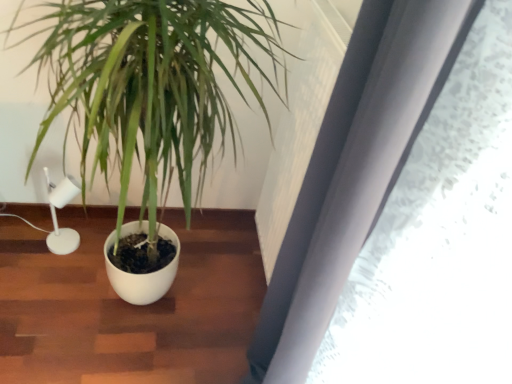
Describe the element at coordinates (152, 87) in the screenshot. I see `green matte plant at center` at that location.

What is the approximate width of green matte plant at center?

green matte plant at center is 78.47 centimeters in width.

Where is `green matte plant at center`? The image size is (512, 384). green matte plant at center is located at coordinates (152, 87).

The height and width of the screenshot is (384, 512). What do you see at coordinates (56, 215) in the screenshot? I see `white matte lamp at left` at bounding box center [56, 215].

In order to click on white matte lamp at left in this screenshot , I will do `click(56, 215)`.

Where is `green matte plant at center`? green matte plant at center is located at coordinates [152, 87].

Can you confirm if white matte lamp at left is positioned to the left of green matte plant at center?

Correct, you'll find white matte lamp at left to the left of green matte plant at center.

In the scene shown: Which object is closer to the camera taking this photo, white matte lamp at left or green matte plant at center?

green matte plant at center is in front.

Is point (74, 195) closer or farther from the camera than point (36, 140)?

Point (74, 195) is positioned farther from the camera compared to point (36, 140).

From the image's perspective, between white matte lamp at left and green matte plant at center, which one is located above?

From the image's view, green matte plant at center is above.

From a real-world perspective, does white matte lamp at left stand above green matte plant at center?

No, from a real-world perspective, white matte lamp at left is not over green matte plant at center

Which of these two, white matte lamp at left or green matte plant at center, is thinner?

Answer: With smaller width is white matte lamp at left.

Can you confirm if white matte lamp at left is taller than green matte plant at center?

Incorrect, the height of white matte lamp at left is not larger of that of green matte plant at center.

Can you confirm if white matte lamp at left is smaller than green matte plant at center?

Yes.

Looking at this image, would you say green matte plant at center is part of white matte lamp at left's contents?

No, green matte plant at center is not a part of white matte lamp at left.

Is white matte lamp at left next to green matte plant at center?

No, white matte lamp at left is not beside green matte plant at center.

Is white matte lamp at left turned away from green matte plant at center?

Yes, white matte lamp at left is facing away from green matte plant at center.

How many degrees apart are the facing directions of white matte lamp at left and green matte plant at center?

There is a 1.57-degree angle between the facing directions of white matte lamp at left and green matte plant at center.

Locate an element on the screen. houseplant in front of the white matte lamp at left is located at coordinates (152, 87).

Does green matte plant at center appear on the right side of white matte lamp at left?

Yes, green matte plant at center is to the right of white matte lamp at left.

Is green matte plant at center behind white matte lamp at left?

No, green matte plant at center is in front of white matte lamp at left.

Does point (84, 117) lie behind point (57, 199)?

No, it is not.

From the image's perspective, between green matte plant at center and white matte lamp at left, who is located below?

From the image's view, white matte lamp at left is below.

From a real-world perspective, relative to white matte lamp at left, is green matte plant at center vertically above or below?

green matte plant at center is situated higher than white matte lamp at left in the real world.

Considering the sizes of objects green matte plant at center and white matte lamp at left in the image provided, who is thinner, green matte plant at center or white matte lamp at left?

white matte lamp at left.

Between green matte plant at center and white matte lamp at left, which one has less height?

With less height is white matte lamp at left.

Considering the sizes of green matte plant at center and white matte lamp at left in the image, is green matte plant at center bigger or smaller than white matte lamp at left?

Considering their sizes, green matte plant at center takes up more space than white matte lamp at left.

Can white matte lamp at left be found inside green matte plant at center?

Yes, green matte plant at center is surrounding white matte lamp at left.

Are green matte plant at center and white matte lamp at left far apart?

Actually, green matte plant at center and white matte lamp at left are a little close together.

Could you tell me if green matte plant at center is turned towards white matte lamp at left?

No, green matte plant at center is not turned towards white matte lamp at left.

What's the angular difference between green matte plant at center and white matte lamp at left's facing directions?

The facing directions of green matte plant at center and white matte lamp at left are 1.57 degrees apart.

Find the location of a particular element. Image resolution: width=512 pixels, height=384 pixels. houseplant above the white matte lamp at left (from a real-world perspective) is located at coordinates (152, 87).

Find the location of a particular element. This screenshot has width=512, height=384. houseplant located on the right of white matte lamp at left is located at coordinates (152, 87).

Locate an element on the screen. The image size is (512, 384). lamp on the left of green matte plant at center is located at coordinates (56, 215).